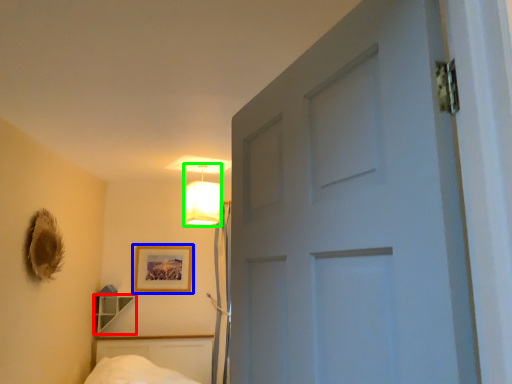
Question: Estimate the real-world distances between objects in this image. Which object is farther from shelf (highlighted by a red box), picture frame (highlighted by a blue box) or lamp (highlighted by a green box)?

Choices:
 (A) picture frame
 (B) lamp

Answer: (B)